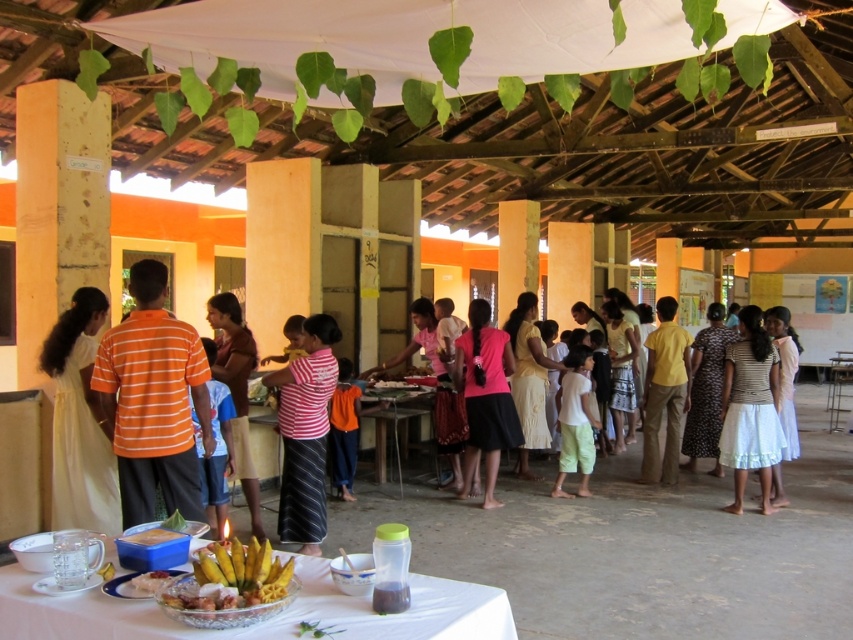
You are setting up a small decoration on the clear glass bowl at center. Since the bowl is on the wooden table at center, will the decoration be visible from above the table?

The clear glass bowl at center has a lesser height compared to wooden table at center, so the decoration placed on the bowl will still be visible from above the table since the bowl is not tall enough to block the view.

You are a photographer setting up a shot of the scene. You want to capture both the striped fabric skirt at center and the yellow shiny bananas at center in the same frame. Which object should you focus on first to ensure both are in focus?

The striped fabric skirt at center is above the yellow shiny bananas at center, so you should focus on the striped fabric skirt at center first to ensure both are in focus.

You are at the gathering and want to hand a banana to the person wearing the orange striped shirt at left. Since you are standing near the pink fabric skirt at center, which direction should you move to reach them?

The orange striped shirt at left is to the left of the pink fabric skirt at center, so you should move to your left to reach them.